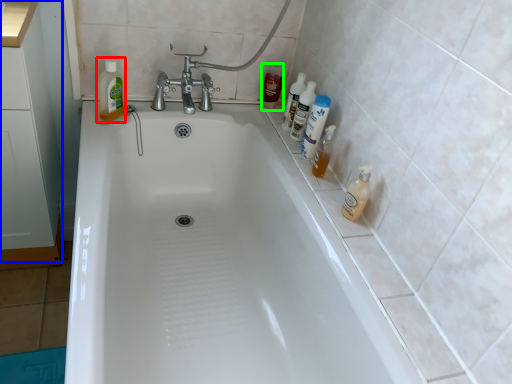
Question: Estimate the real-world distances between objects in this image. Which object is farther from cleaning product (highlighted by a red box), cabinetry (highlighted by a blue box) or toiletry (highlighted by a green box)?

Choices:
 (A) cabinetry
 (B) toiletry

Answer: (B)